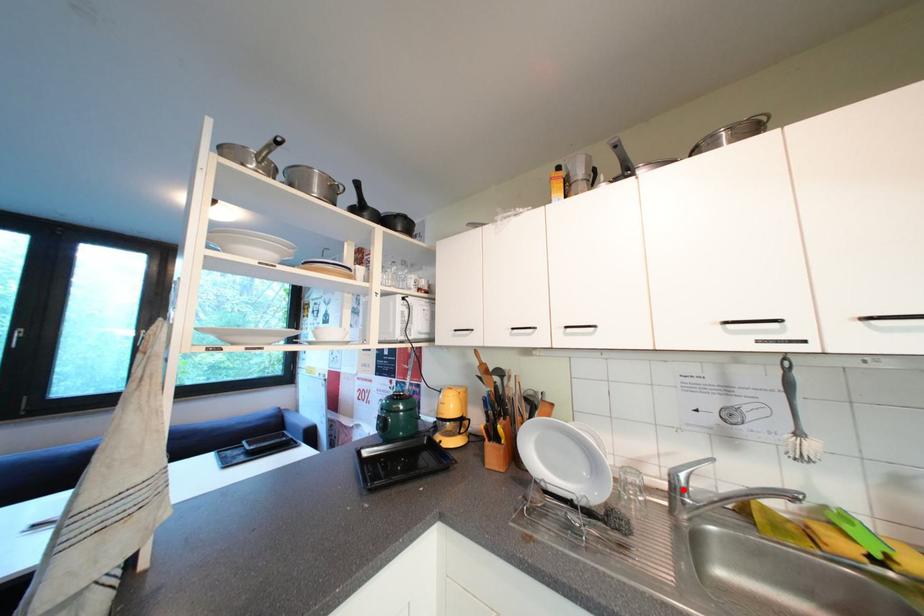
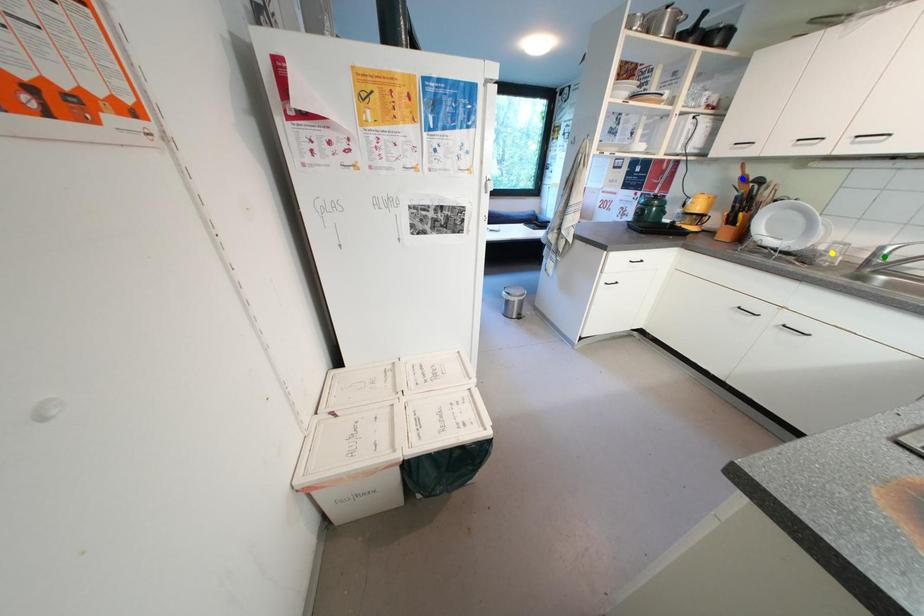
Question: I am providing you with two images of the same scene from different viewpoints. A red point is marked on the first image. You are given multiple points on the second image. Can you choose the point in image 2 that corresponds to the point in image 1?

Choices:
 (A) blue point
 (B) yellow point
 (C) green point

Answer: (C)